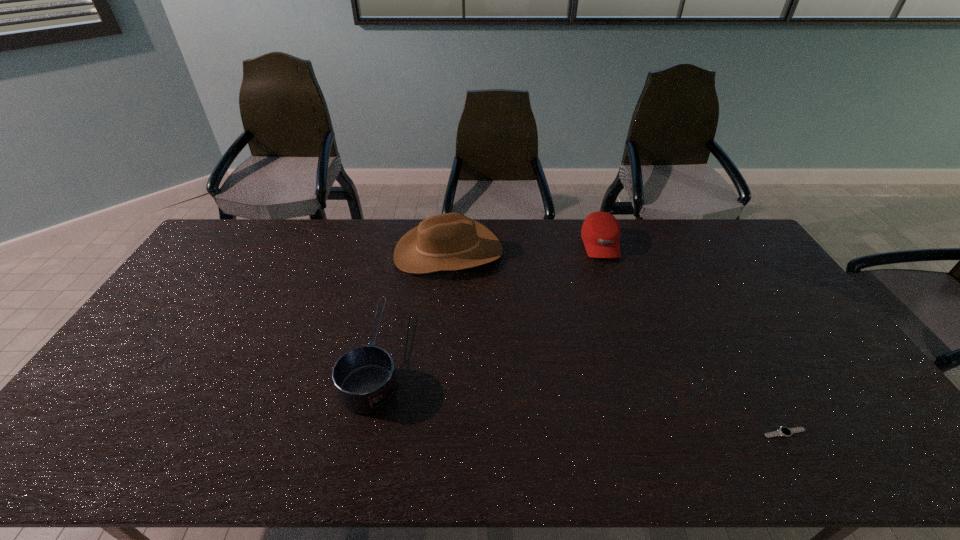
I want to click on object that ranks as the third closest to the cap, so click(784, 431).

Find the location of a particular element. The image size is (960, 540). object that is the second nearest to the second nearest object is located at coordinates (600, 232).

Find the location of a particular element. The height and width of the screenshot is (540, 960). free spot that satisfies the following two spatial constraints: 1. on the front-facing side of the nearest object; 2. on the left side of the third object from left to right is located at coordinates (664, 433).

You are a GUI agent. You are given a task and a screenshot of the screen. Output one action in this format:
    pyautogui.click(x=<x>, y=<y>)
    Task: Click on the free space that satisfies the following two spatial constraints: 1. on the front-facing side of the third object from left to right; 2. on the right side of the watch
    
    Given the screenshot: What is the action you would take?
    pyautogui.click(x=664, y=433)

Locate an element on the screen. The width and height of the screenshot is (960, 540). vacant space that satisfies the following two spatial constraints: 1. with the handle extending from one side of the cowboy hat; 2. on the right side of the saucepan is located at coordinates click(399, 252).